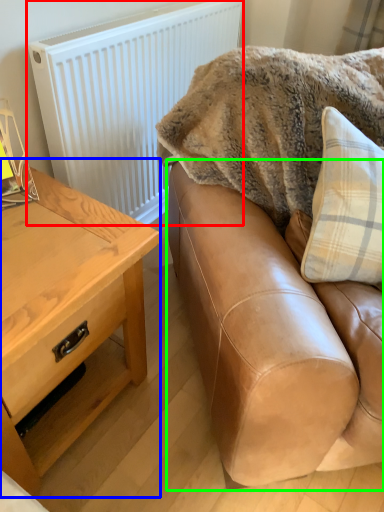
Question: Considering the real-world distances, which object is farthest from radiator (highlighted by a red box)? table (highlighted by a blue box) or studio couch (highlighted by a green box)?

Choices:
 (A) table
 (B) studio couch

Answer: (B)